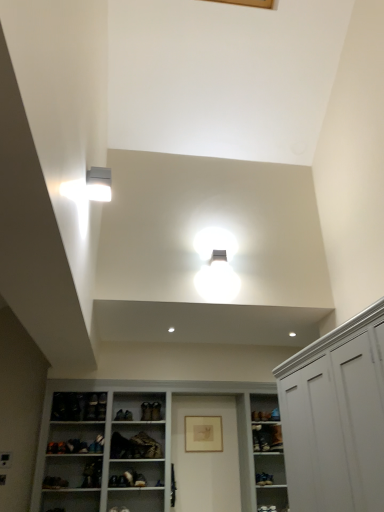
Question: Is matte gold picture frame at center wider or thinner than white plastic light fixture at upper left?

Choices:
 (A) wide
 (B) thin

Answer: (B)

Question: In the image, is matte gold picture frame at center on the left side or the right side of white plastic light fixture at upper left?

Choices:
 (A) right
 (B) left

Answer: (A)

Question: Based on their relative distances, which object is farther from the leather shoe at center, which is the second shoe from left to right?

Choices:
 (A) white plastic light fixture at upper left
 (B) matte gold picture frame at center
 (C) leather at center, the 1th shoe when ordered from left to right
 (D) white matte cabinet at right
 (E) white glossy cupboard at lower center

Answer: (A)

Question: Which object is the farthest from the white plastic light fixture at upper left?

Choices:
 (A) matte gold picture frame at center
 (B) leather shoe at center, which is the second shoe from left to right
 (C) white glossy cupboard at lower center
 (D) leather at center, acting as the second shoe starting from the right
 (E) white matte cabinet at right

Answer: (A)